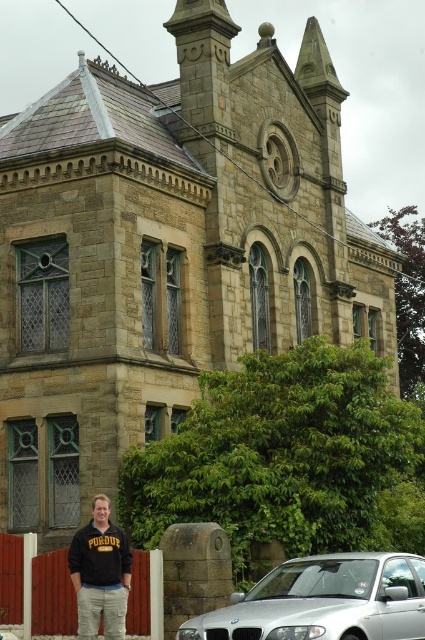
Question: Which point is closer to the camera?

Choices:
 (A) (107, 600)
 (B) (410, 609)

Answer: (B)

Question: Is silver metallic car at lower center wider than black sweatshirt at lower left?

Choices:
 (A) yes
 (B) no

Answer: (A)

Question: Which of the following is the farthest from the observer?

Choices:
 (A) (283, 566)
 (B) (76, 592)

Answer: (A)

Question: Observing the image, what is the correct spatial positioning of silver metallic car at lower center in reference to black sweatshirt at lower left?

Choices:
 (A) below
 (B) above

Answer: (A)

Question: Is silver metallic car at lower center wider than black sweatshirt at lower left?

Choices:
 (A) no
 (B) yes

Answer: (B)